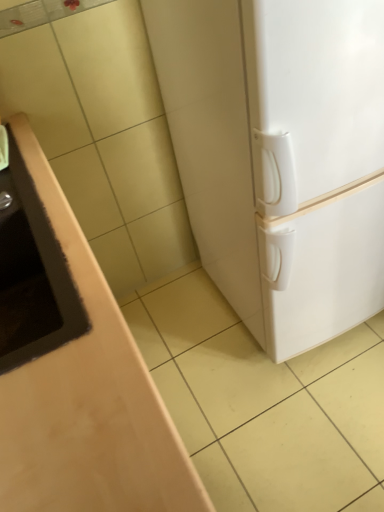
Question: Considering the relative positions of matte brown sink at left and white matte refrigerator at right in the image provided, is matte brown sink at left to the left of white matte refrigerator at right from the viewer's perspective?

Choices:
 (A) no
 (B) yes

Answer: (B)

Question: Considering the relative positions of matte brown sink at left and white matte refrigerator at right in the image provided, is matte brown sink at left in front of white matte refrigerator at right?

Choices:
 (A) yes
 (B) no

Answer: (A)

Question: From the image's perspective, is matte brown sink at left beneath white matte refrigerator at right?

Choices:
 (A) yes
 (B) no

Answer: (A)

Question: Is matte brown sink at left to the right of white matte refrigerator at right from the viewer's perspective?

Choices:
 (A) yes
 (B) no

Answer: (B)

Question: Can you confirm if matte brown sink at left is smaller than white matte refrigerator at right?

Choices:
 (A) no
 (B) yes

Answer: (B)

Question: Does matte brown sink at left have a greater width compared to white matte refrigerator at right?

Choices:
 (A) yes
 (B) no

Answer: (B)

Question: Is white matte refrigerator at right further to camera compared to matte brown sink at left?

Choices:
 (A) no
 (B) yes

Answer: (B)

Question: Is white matte refrigerator at right to the right of matte brown sink at left from the viewer's perspective?

Choices:
 (A) no
 (B) yes

Answer: (B)

Question: Is white matte refrigerator at right not close to matte brown sink at left?

Choices:
 (A) yes
 (B) no

Answer: (B)

Question: Is white matte refrigerator at right thinner than matte brown sink at left?

Choices:
 (A) yes
 (B) no

Answer: (B)

Question: Is white matte refrigerator at right looking in the opposite direction of matte brown sink at left?

Choices:
 (A) yes
 (B) no

Answer: (B)

Question: Is white matte refrigerator at right not inside matte brown sink at left?

Choices:
 (A) yes
 (B) no

Answer: (A)

Question: From a real-world perspective, relative to white matte refrigerator at right, is matte brown sink at left vertically above or below?

Choices:
 (A) below
 (B) above

Answer: (B)